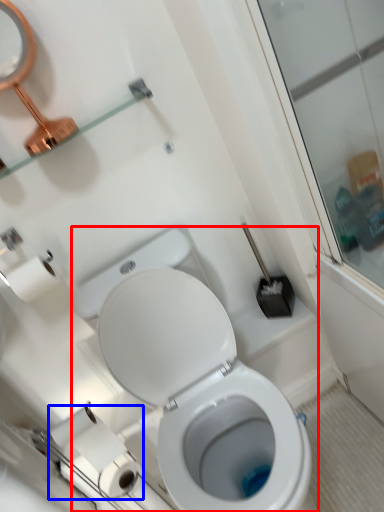
Question: Among these objects, which one is nearest to the camera, toilet (highlighted by a red box) or toilet paper (highlighted by a blue box)?

Choices:
 (A) toilet
 (B) toilet paper

Answer: (A)